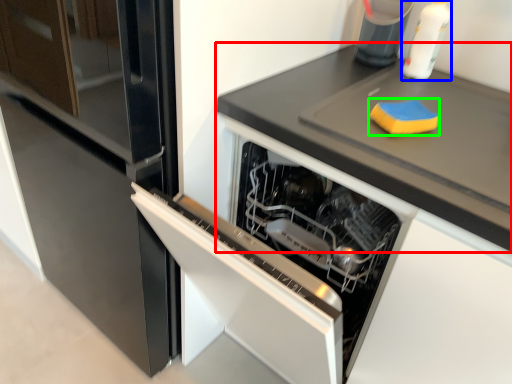
Question: Considering the real-world distances, which object is farthest from countertop (highlighted by a red box)? bottle (highlighted by a blue box) or food (highlighted by a green box)?

Choices:
 (A) bottle
 (B) food

Answer: (A)